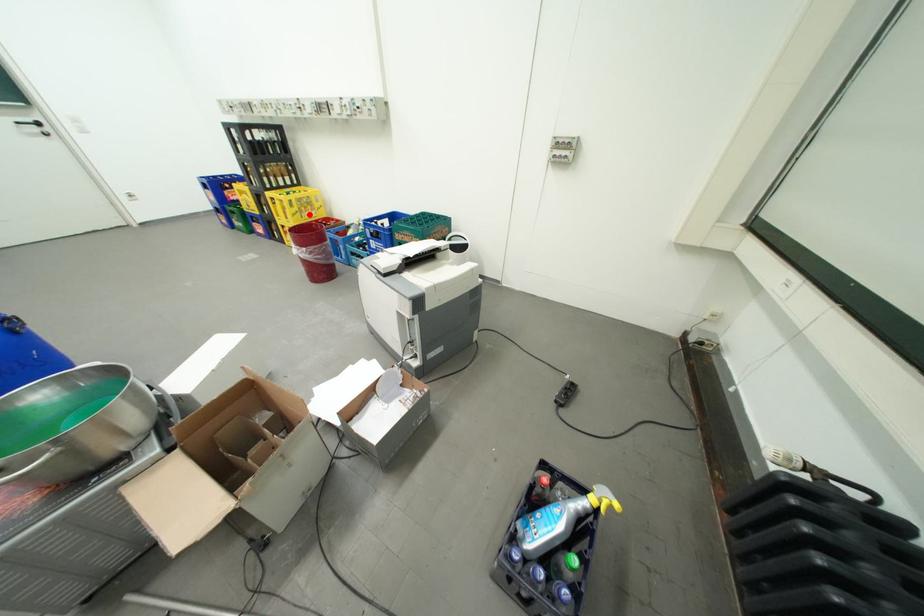
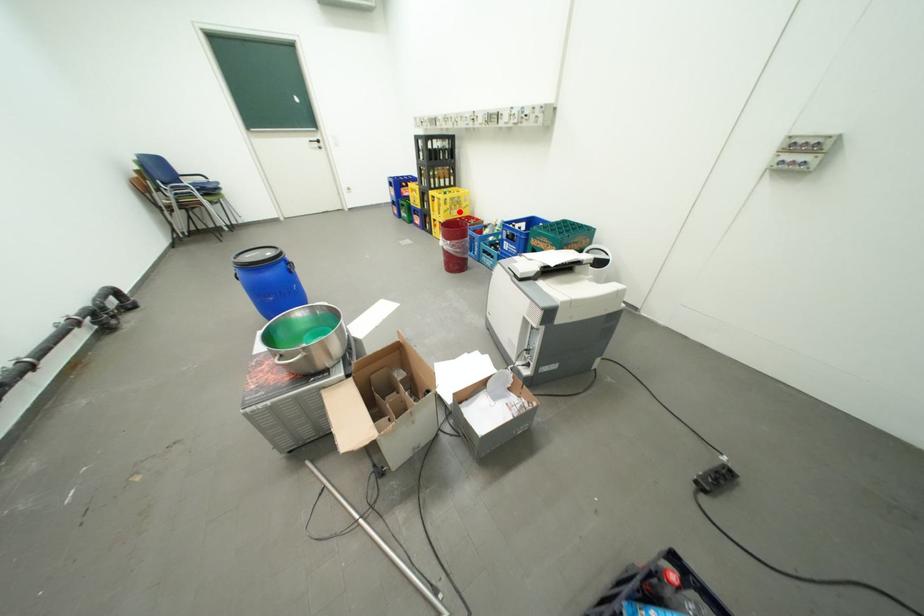
I am providing you with two images of the same scene from different viewpoints. A red point is marked on the first image and another point is marked on the second image. Is the red point in image1 aligned with the point shown in image2?

Yes